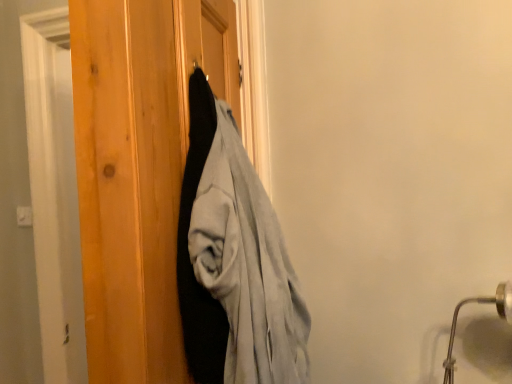
Question: From the image's perspective, does silver metallic door handle at lower right appear higher than matte black coat at center?

Choices:
 (A) no
 (B) yes

Answer: (A)

Question: Would you say matte black coat at center is part of silver metallic door handle at lower right's contents?

Choices:
 (A) yes
 (B) no

Answer: (B)

Question: Is silver metallic door handle at lower right to the right of matte black coat at center from the viewer's perspective?

Choices:
 (A) yes
 (B) no

Answer: (A)

Question: Can you confirm if silver metallic door handle at lower right is bigger than matte black coat at center?

Choices:
 (A) no
 (B) yes

Answer: (A)

Question: Can you confirm if silver metallic door handle at lower right is thinner than matte black coat at center?

Choices:
 (A) yes
 (B) no

Answer: (B)

Question: From a real-world perspective, does silver metallic door handle at lower right stand above matte black coat at center?

Choices:
 (A) no
 (B) yes

Answer: (A)

Question: Can you confirm if matte black coat at center is thinner than silver metallic door handle at lower right?

Choices:
 (A) no
 (B) yes

Answer: (B)

Question: Is silver metallic door handle at lower right inside matte black coat at center?

Choices:
 (A) yes
 (B) no

Answer: (B)

Question: Does matte black coat at center appear on the left side of silver metallic door handle at lower right?

Choices:
 (A) no
 (B) yes

Answer: (B)

Question: Is matte black coat at center further to the viewer compared to silver metallic door handle at lower right?

Choices:
 (A) no
 (B) yes

Answer: (A)

Question: Does matte black coat at center touch silver metallic door handle at lower right?

Choices:
 (A) no
 (B) yes

Answer: (A)

Question: Considering the relative sizes of matte black coat at center and silver metallic door handle at lower right in the image provided, is matte black coat at center shorter than silver metallic door handle at lower right?

Choices:
 (A) yes
 (B) no

Answer: (B)

Question: In terms of height, does matte black coat at center look taller or shorter compared to silver metallic door handle at lower right?

Choices:
 (A) tall
 (B) short

Answer: (A)